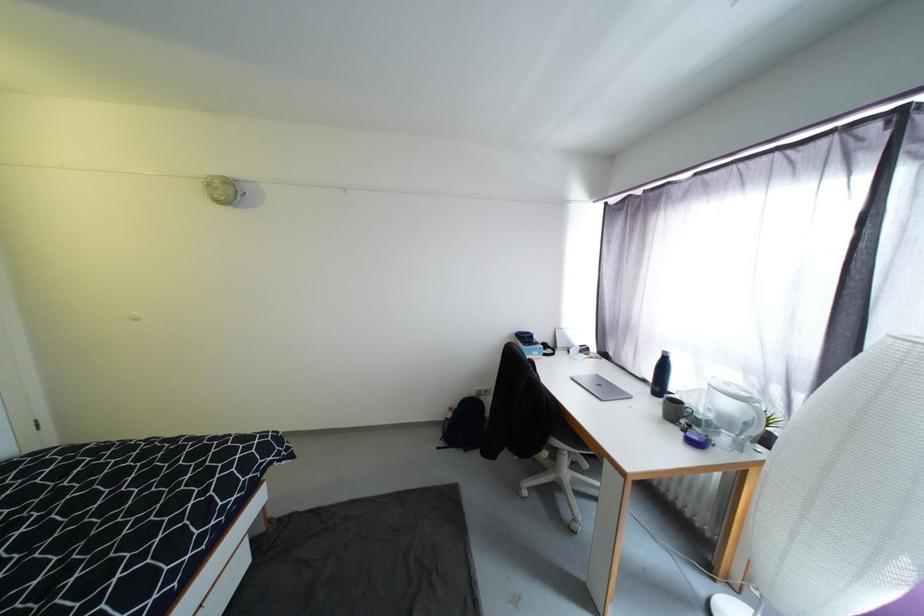
Which object does [661,375] point to?

It corresponds to the dark blue bottle in the image.